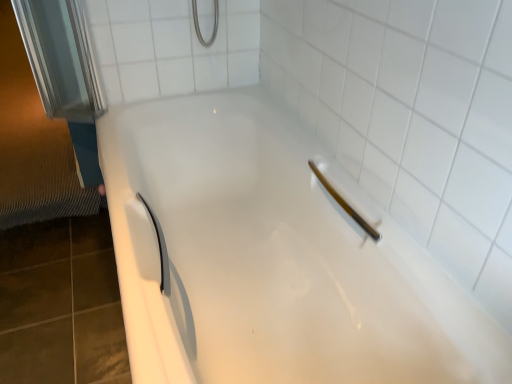
Question: Considering the relative positions of white glossy bathtub at center and matte white shower at upper right in the image provided, is white glossy bathtub at center to the right of matte white shower at upper right from the viewer's perspective?

Choices:
 (A) yes
 (B) no

Answer: (B)

Question: Does white glossy bathtub at center have a greater height compared to matte white shower at upper right?

Choices:
 (A) no
 (B) yes

Answer: (B)

Question: Is matte white shower at upper right at the back of white glossy bathtub at center?

Choices:
 (A) yes
 (B) no

Answer: (A)

Question: Could you tell me if white glossy bathtub at center is turned towards matte white shower at upper right?

Choices:
 (A) yes
 (B) no

Answer: (B)

Question: Is matte white shower at upper right surrounded by white glossy bathtub at center?

Choices:
 (A) yes
 (B) no

Answer: (A)

Question: Can you confirm if white glossy bathtub at center is smaller than matte white shower at upper right?

Choices:
 (A) no
 (B) yes

Answer: (A)

Question: Can you confirm if matte white shower at upper right is taller than white glossy bathtub at center?

Choices:
 (A) yes
 (B) no

Answer: (B)

Question: Is matte white shower at upper right wider than white glossy bathtub at center?

Choices:
 (A) no
 (B) yes

Answer: (A)

Question: Does matte white shower at upper right come behind white glossy bathtub at center?

Choices:
 (A) yes
 (B) no

Answer: (A)

Question: Considering the relative positions of matte white shower at upper right and white glossy bathtub at center in the image provided, is matte white shower at upper right to the left of white glossy bathtub at center from the viewer's perspective?

Choices:
 (A) yes
 (B) no

Answer: (B)

Question: From the image's perspective, is matte white shower at upper right above white glossy bathtub at center?

Choices:
 (A) yes
 (B) no

Answer: (A)

Question: Considering the relative sizes of matte white shower at upper right and white glossy bathtub at center in the image provided, is matte white shower at upper right thinner than white glossy bathtub at center?

Choices:
 (A) yes
 (B) no

Answer: (A)

Question: Does white ceramic tile at upper center lie in front of matte white shower at upper right?

Choices:
 (A) yes
 (B) no

Answer: (B)